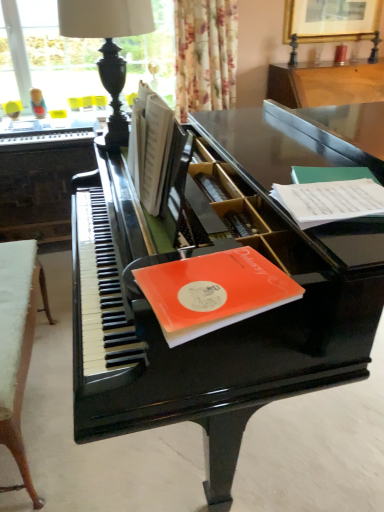
In order to click on vacant area on top of orange matte paper at piano top, positioned as the 2th paperback book in top-to-bottom order (from a real-world perspective) in this screenshot , I will do `click(206, 284)`.